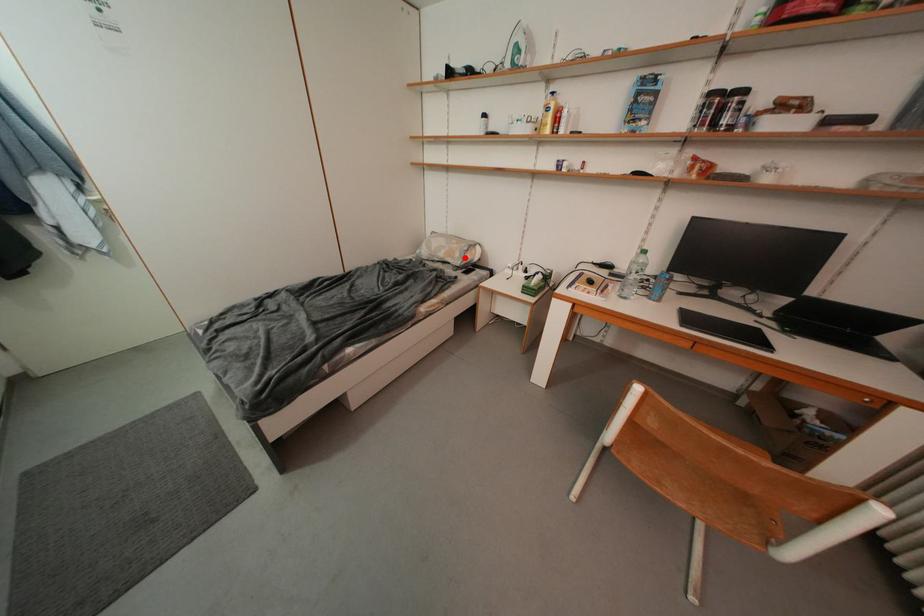
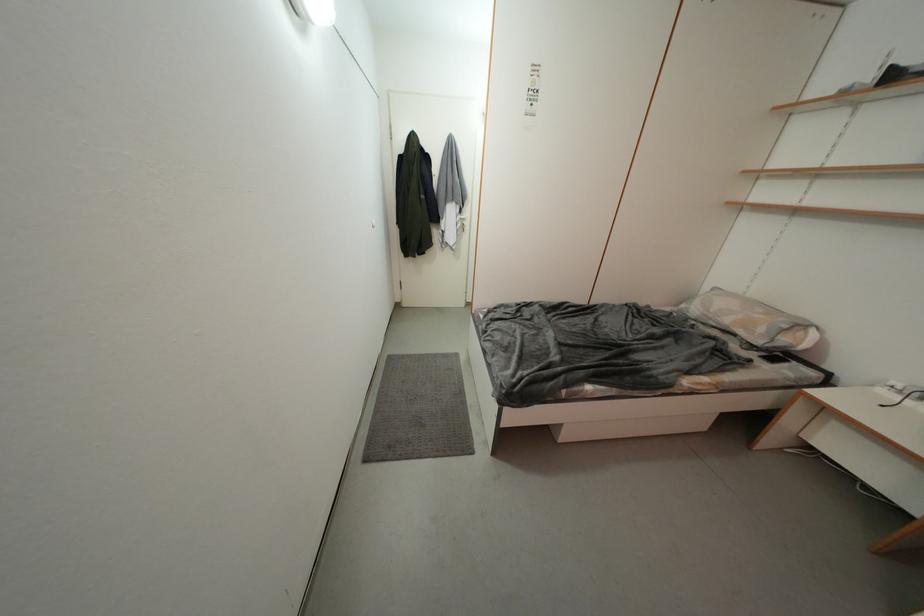
In the second image, find the point that corresponds to the highlighted location in the first image.

(769, 333)